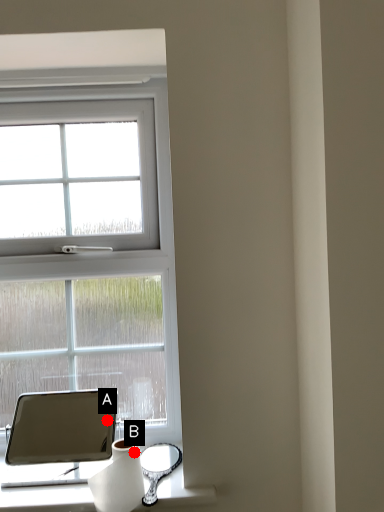
Question: Two points are circled on the image, labeled by A and B beside each circle. Which point is farther to the camera?

Choices:
 (A) A is further
 (B) B is further

Answer: (A)